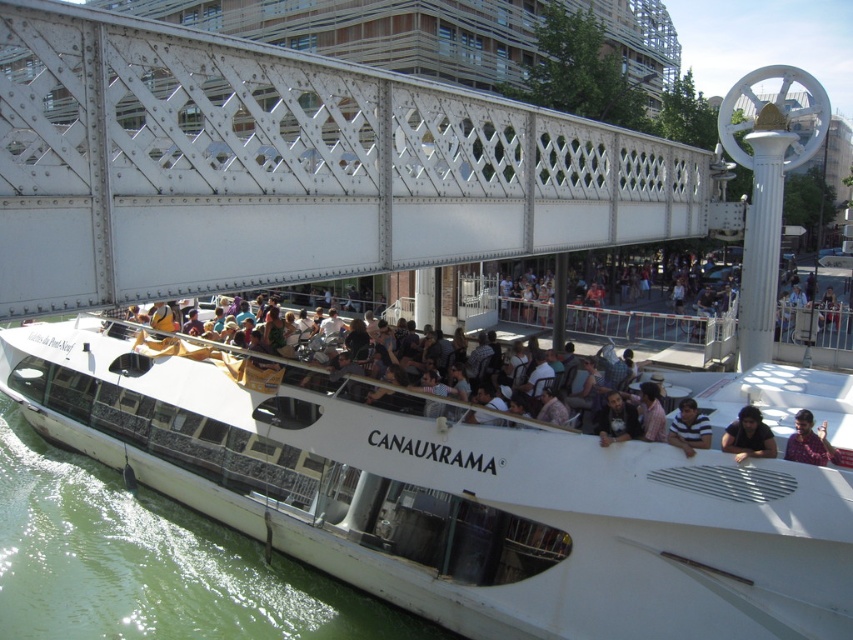
How much distance is there between white metal bridge at upper center and striped shirt at center?

white metal bridge at upper center and striped shirt at center are 38.30 feet apart from each other.

Which is in front, point (256, 220) or point (669, 426)?

Point (256, 220)

Locate an element on the screen. This screenshot has width=853, height=640. white metal bridge at upper center is located at coordinates (285, 168).

Who is positioned more to the left, dark brown hair at upper right or dark brown leather jacket at center?

dark brown leather jacket at center

Based on the photo, is dark brown hair at upper right wider than dark brown leather jacket at center?

Yes, dark brown hair at upper right is wider than dark brown leather jacket at center.

What do you see at coordinates (807, 442) in the screenshot? I see `dark brown hair at upper right` at bounding box center [807, 442].

In order to click on dark brown hair at upper right in this screenshot , I will do `click(807, 442)`.

In the scene shown: Can you confirm if white glossy boat at center is bigger than dark brown hair at upper right?

Yes.

Who is positioned more to the right, white glossy boat at center or dark brown hair at upper right?

Positioned to the right is dark brown hair at upper right.

Find the location of `white glossy boat at center`. white glossy boat at center is located at coordinates (448, 493).

You are a GUI agent. You are given a task and a screenshot of the screen. Output one action in this format:
    pyautogui.click(x=<x>, y=<y>)
    Task: Click on the white glossy boat at center
    
    Given the screenshot: What is the action you would take?
    pyautogui.click(x=448, y=493)